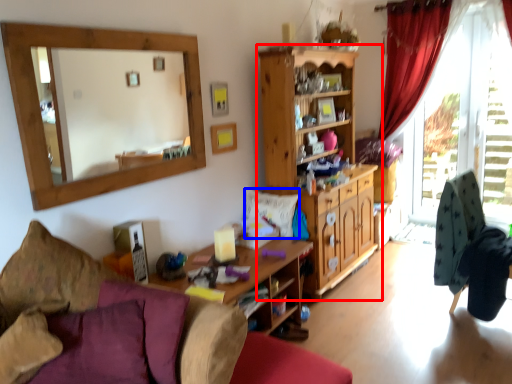
Question: Which object is further to the camera taking this photo, cabinetry (highlighted by a red box) or pillow (highlighted by a blue box)?

Choices:
 (A) cabinetry
 (B) pillow

Answer: (B)